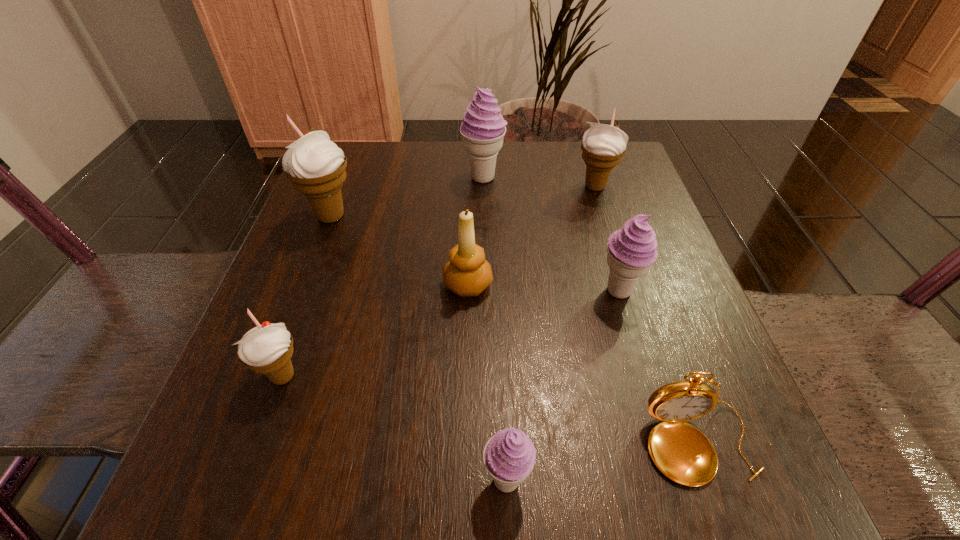
I want to click on the nearest purple icecream, so click(x=509, y=456).

This screenshot has height=540, width=960. I want to click on the nearest icecream, so click(509, 456).

The width and height of the screenshot is (960, 540). I want to click on pocket watch, so click(680, 451).

Locate an element on the screen. This screenshot has width=960, height=540. free space located on the left of the biggest purple icecream is located at coordinates (409, 177).

Locate an element on the screen. free location located on the right of the biggest white icecream is located at coordinates (460, 217).

Locate an element on the screen. free space located 0.070m on the back of the second biggest white icecream is located at coordinates (587, 159).

In order to click on vacant space located 0.390m on the back of the rightmost purple icecream in this screenshot , I will do `click(580, 160)`.

What are the coordinates of `vacant space located on the left of the candle_holder` in the screenshot? It's located at (296, 285).

Find the location of a particular element. The width and height of the screenshot is (960, 540). vacant space located 0.170m on the right of the sixth farthest object is located at coordinates (421, 376).

Where is `vacant space located 0.140m on the right of the smallest purple icecream`? vacant space located 0.140m on the right of the smallest purple icecream is located at coordinates (643, 481).